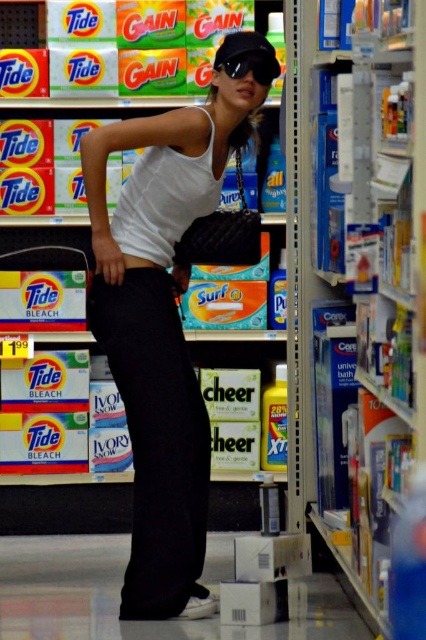
Is black matte pants at lower center wider than black matte sunglasses at upper center?

Yes, black matte pants at lower center is wider than black matte sunglasses at upper center.

Is black matte pants at lower center shorter than black matte sunglasses at upper center?

No.

Does point (173, 566) come farther from viewer compared to point (216, 56)?

Yes, it is behind point (216, 56).

You are a GUI agent. You are given a task and a screenshot of the screen. Output one action in this format:
    pyautogui.click(x=<x>, y=<y>)
    Task: Click on the black matte pants at lower center
    The image size is (426, 640).
    Given the screenshot: What is the action you would take?
    pyautogui.click(x=157, y=440)

Does blue cardboard boxes at center appear over black matte pants at lower center?

Indeed, blue cardboard boxes at center is positioned over black matte pants at lower center.

Does point (345, 83) lie behind point (132, 284)?

No, (345, 83) is closer to viewer.

Find the location of `blue cardboard boxes at center`. blue cardboard boxes at center is located at coordinates (368, 291).

Does matte black purse at center have a smaller size compared to black matte pants at lower center?

No, matte black purse at center is not smaller than black matte pants at lower center.

Consider the image. Who is shorter, matte black purse at center or black matte pants at lower center?

black matte pants at lower center

At what (x,y) coordinates should I click in order to perform the action: click on matte black purse at center. Please return your answer as a coordinate pair (x, y). This screenshot has height=640, width=426. Looking at the image, I should click on (161, 330).